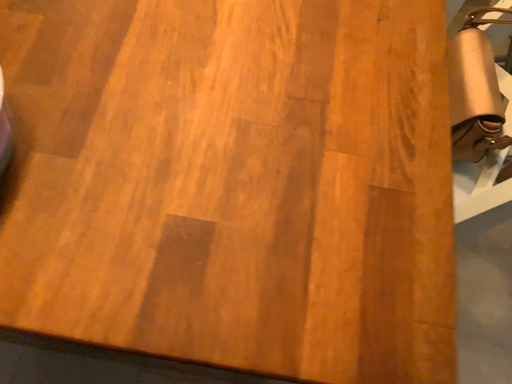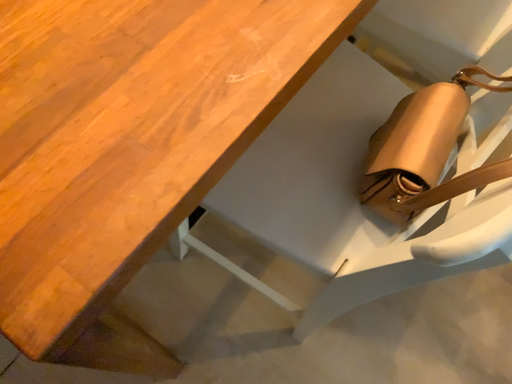
Question: Which way did the camera rotate in the video?

Choices:
 (A) rotated left
 (B) rotated right

Answer: (A)